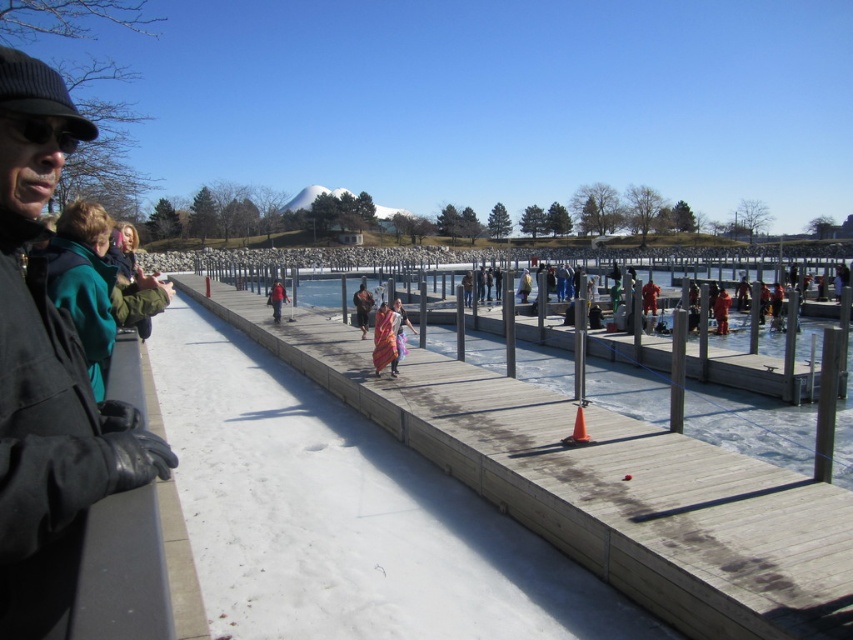
Consider the image. You are a photographer trying to capture a wide shot of the winter dock scene. Your camera has a 10cm wide lens opening. You notice the black woolen hat at upper left and the multicolored woven cloth at center in your viewfinder. Based on their widths, will both objects fit within the lens opening if you frame the shot to include both?

The black woolen hat at upper left might be wider than multicolored woven cloth at center. Since the lens opening is 10cm wide, it depends on the actual width of the black woolen hat at upper left. If it is wider than 10cm, then both won

You are standing at the edge of the dock and want to place a decorative flag exactly where the multicolored woven cloth at center is located. According to the coordinates provided, what are the coordinates where you should place the flag?

The coordinates for the multicolored woven cloth at center are at point (384, 340), so you should place the flag at those coordinates.